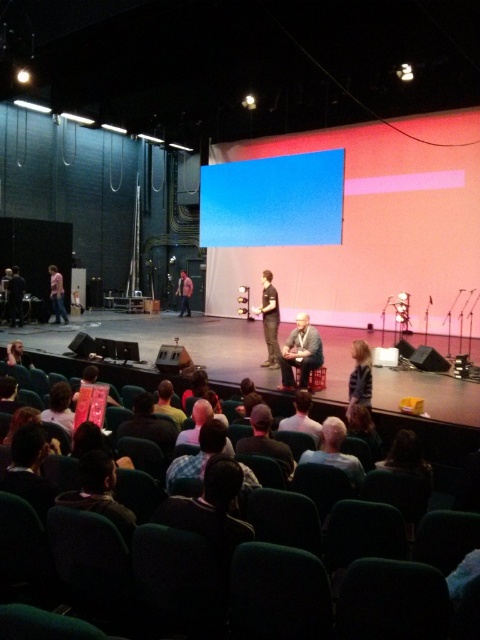
Question: Can you confirm if dark gray pants at center is wider than light brown leather jacket at center?

Choices:
 (A) no
 (B) yes

Answer: (A)

Question: Is dark brown hair at center to the right of light brown leather jacket at lower left from the viewer's perspective?

Choices:
 (A) no
 (B) yes

Answer: (B)

Question: Based on their relative distances, which object is farther from the light brown leather jacket at lower left?

Choices:
 (A) dark brown hair at center
 (B) light brown leather jacket at center
 (C) suit at center

Answer: (A)

Question: Among these objects, which one is farthest from the camera?

Choices:
 (A) light brown leather jacket at lower left
 (B) dark gray pants at center

Answer: (A)

Question: Considering the real-world distances, which object is farthest from the light brown leather jacket at lower left?

Choices:
 (A) light brown leather jacket at center
 (B) dark gray pants at center
 (C) dark brown leather jacket at lower left

Answer: (C)

Question: Can you confirm if suit at center is smaller than blonde hair at lower right?

Choices:
 (A) yes
 (B) no

Answer: (B)